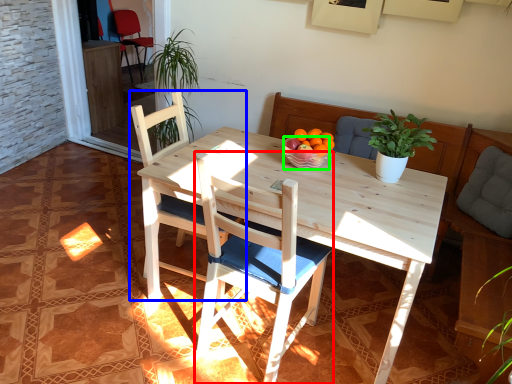
Question: Which object is positioned closest to chair (highlighted by a red box)? Select from chair (highlighted by a blue box) and bowl (highlighted by a green box).

Choices:
 (A) chair
 (B) bowl

Answer: (A)